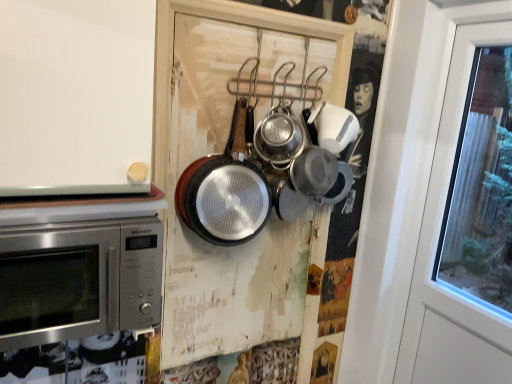
Question: Is black textured frying pan at center, which ranks as the second frying pan in right-to-left order, to the left of silver textured frying pan at center, the 1th frying pan when ordered from right to left, from the viewer's perspective?

Choices:
 (A) no
 (B) yes

Answer: (B)

Question: Is black textured frying pan at center, acting as the first frying pan starting from the left, oriented towards silver textured frying pan at center, the 1th frying pan when ordered from right to left?

Choices:
 (A) no
 (B) yes

Answer: (A)

Question: Is black textured frying pan at center, acting as the first frying pan starting from the left, far from silver textured frying pan at center, placed as the 2th frying pan when sorted from left to right?

Choices:
 (A) no
 (B) yes

Answer: (A)

Question: From a real-world perspective, is black textured frying pan at center, which ranks as the second frying pan in right-to-left order, physically below silver textured frying pan at center, placed as the 2th frying pan when sorted from left to right?

Choices:
 (A) no
 (B) yes

Answer: (B)

Question: From the image's perspective, does black textured frying pan at center, acting as the first frying pan starting from the left, appear lower than silver textured frying pan at center, placed as the 2th frying pan when sorted from left to right?

Choices:
 (A) yes
 (B) no

Answer: (A)

Question: Which is correct: black textured frying pan at center, acting as the first frying pan starting from the left, is inside stainless steel microwave at left, or outside of it?

Choices:
 (A) outside
 (B) inside

Answer: (A)

Question: From a real-world perspective, is black textured frying pan at center, acting as the first frying pan starting from the left, above or below stainless steel microwave at left?

Choices:
 (A) below
 (B) above

Answer: (B)

Question: Is black textured frying pan at center, acting as the first frying pan starting from the left, to the left or to the right of stainless steel microwave at left in the image?

Choices:
 (A) right
 (B) left

Answer: (A)

Question: Considering the positions of black textured frying pan at center, acting as the first frying pan starting from the left, and stainless steel microwave at left in the image, is black textured frying pan at center, acting as the first frying pan starting from the left, bigger or smaller than stainless steel microwave at left?

Choices:
 (A) small
 (B) big

Answer: (A)

Question: Based on their sizes in the image, would you say stainless steel microwave at left is bigger or smaller than silver textured frying pan at center, placed as the 2th frying pan when sorted from left to right?

Choices:
 (A) big
 (B) small

Answer: (A)

Question: Considering the positions of point (138, 276) and point (281, 134), is point (138, 276) closer or farther from the camera than point (281, 134)?

Choices:
 (A) closer
 (B) farther

Answer: (A)

Question: Considering the positions of stainless steel microwave at left and silver textured frying pan at center, the 1th frying pan when ordered from right to left, in the image, is stainless steel microwave at left taller or shorter than silver textured frying pan at center, the 1th frying pan when ordered from right to left,?

Choices:
 (A) tall
 (B) short

Answer: (A)

Question: From a real-world perspective, is stainless steel microwave at left positioned above or below silver textured frying pan at center, the 1th frying pan when ordered from right to left?

Choices:
 (A) below
 (B) above

Answer: (A)

Question: From a real-world perspective, is silver textured frying pan at center, placed as the 2th frying pan when sorted from left to right, positioned above or below black textured frying pan at center, acting as the first frying pan starting from the left?

Choices:
 (A) below
 (B) above

Answer: (B)

Question: Is silver textured frying pan at center, placed as the 2th frying pan when sorted from left to right, to the left or to the right of black textured frying pan at center, which ranks as the second frying pan in right-to-left order, in the image?

Choices:
 (A) left
 (B) right

Answer: (B)